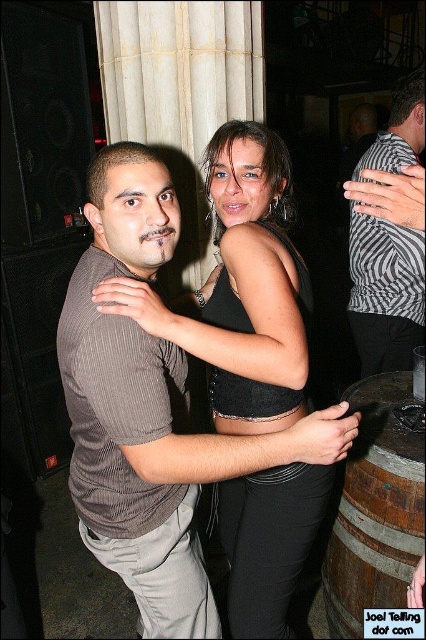
Question: Which point is farther from the camera taking this photo?

Choices:
 (A) (342, 440)
 (B) (405, 506)

Answer: (B)

Question: Is brown wooden barrel at lower right positioned in front of zebra-striped shirt at center?

Choices:
 (A) no
 (B) yes

Answer: (B)

Question: Which object appears farthest from the camera in this image?

Choices:
 (A) brown striped shirt at center
 (B) brown wooden barrel at lower right

Answer: (B)

Question: Is brown striped shirt at center further to the viewer compared to zebra-striped shirt at center?

Choices:
 (A) yes
 (B) no

Answer: (B)

Question: Does brown wooden barrel at lower right have a greater width compared to zebra-striped shirt at center?

Choices:
 (A) yes
 (B) no

Answer: (B)

Question: Which object is the farthest from the zebra-striped shirt at center?

Choices:
 (A) brown striped shirt at center
 (B) brown wooden barrel at lower right

Answer: (A)